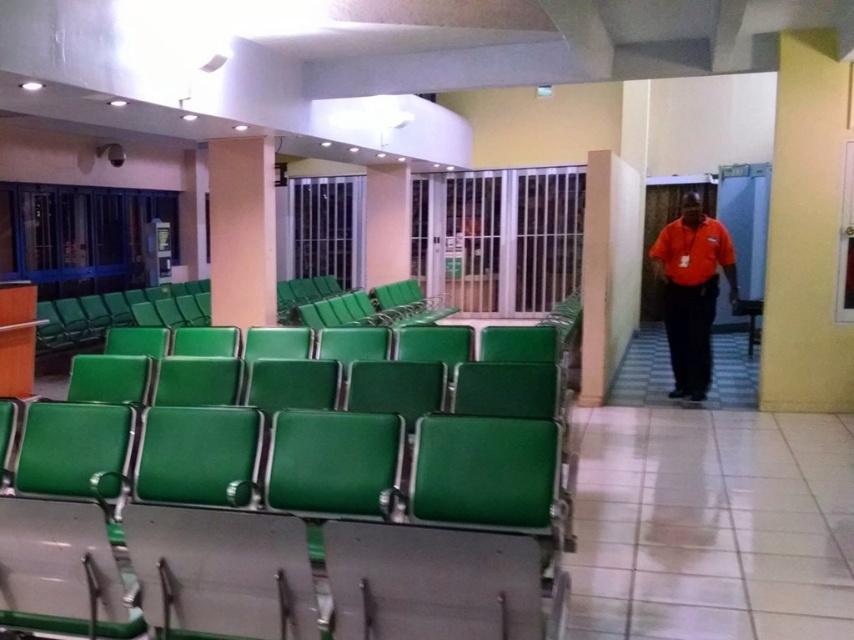
You are a maintenance worker who needs to wrap a protective cover around the green painted concrete pillar at right and the white glossy pillar at center. Based on the pillars in the image, which pillar requires a wider cover?

The green painted concrete pillar at right requires a wider cover because it is wider than the white glossy pillar at center according to the description.

You are standing in the waiting area and want to move from your current position to the exit. You notice two points marked on the floor at coordinates point (673, 262) and point (399, 250). Which point should you walk towards if you want to reach the exit first?

You should walk towards point (673, 262) because it is in front of point (399, 250), meaning it is closer to the exit.